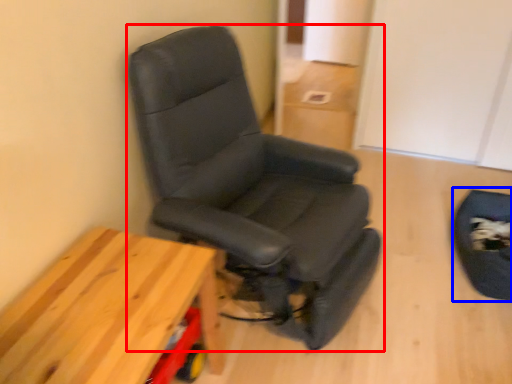
Question: Which point is closer to the camera, chair (highlighted by a red box) or swivel chair (highlighted by a blue box)?

Choices:
 (A) chair
 (B) swivel chair

Answer: (A)